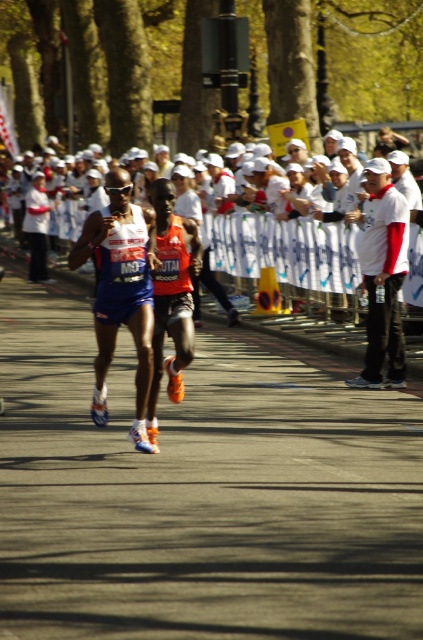
Between blue fabric running suit at center and white matte shirt at upper right, which one has less height?

With less height is blue fabric running suit at center.

Does blue fabric running suit at center have a lesser width compared to white matte shirt at upper right?

No, blue fabric running suit at center is not thinner than white matte shirt at upper right.

Describe the element at coordinates (120, 291) in the screenshot. I see `blue fabric running suit at center` at that location.

Find the location of `blue fabric running suit at center`. blue fabric running suit at center is located at coordinates (120, 291).